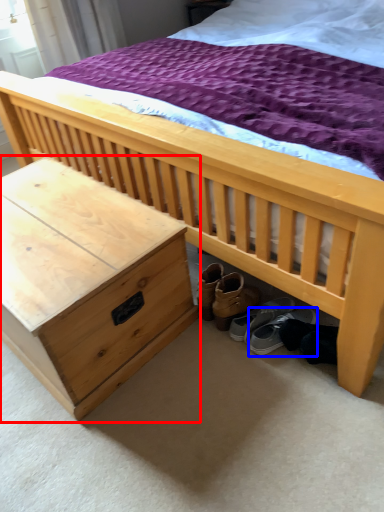
Question: Which point is further to the camera, nightstand (highlighted by a red box) or footwear (highlighted by a blue box)?

Choices:
 (A) nightstand
 (B) footwear

Answer: (B)